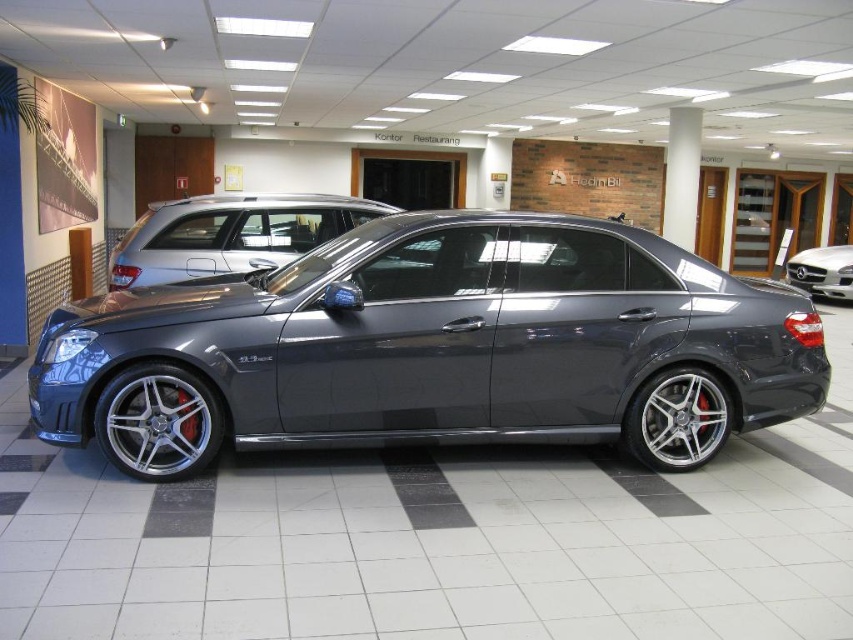
Is satin metallic car at center to the right of satin metallic sedan at center from the viewer's perspective?

Yes, satin metallic car at center is to the right of satin metallic sedan at center.

From the picture: Between satin metallic car at center and satin metallic sedan at center, which one has less height?

satin metallic sedan at center

Which is in front, point (688, 456) or point (177, 225)?

Point (688, 456) is more forward.

The height and width of the screenshot is (640, 853). In order to click on satin metallic car at center in this screenshot , I will do `click(434, 348)`.

Is satin metallic sedan at center further to camera compared to satin black sedan at center?

No, satin metallic sedan at center is in front of satin black sedan at center.

Can you confirm if satin metallic sedan at center is smaller than satin black sedan at center?

No, satin metallic sedan at center is not smaller than satin black sedan at center.

In order to click on satin metallic sedan at center in this screenshot , I will do `click(230, 234)`.

Does satin metallic car at center appear on the right side of satin black sedan at center?

In fact, satin metallic car at center is to the left of satin black sedan at center.

Who is lower down, satin metallic car at center or satin black sedan at center?

satin metallic car at center is lower down.

The height and width of the screenshot is (640, 853). I want to click on satin metallic car at center, so click(x=434, y=348).